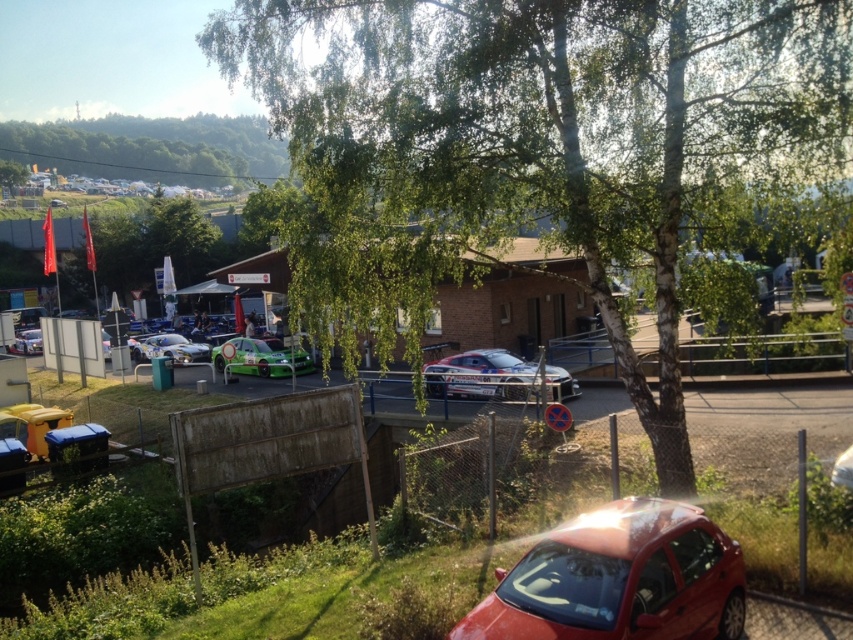
In order to click on green leafy tree at upper left in this screenshot , I will do `click(152, 147)`.

Between point (210, 150) and point (480, 396), which one is positioned behind?

The point (210, 150) is behind.

Locate an element on the screen. green leafy tree at upper left is located at coordinates (152, 147).

Based on the photo, which of these two, green leafy tree at upper left or green matte car at center, stands shorter?

With less height is green matte car at center.

Can you confirm if green leafy tree at upper left is smaller than green matte car at center?

Actually, green leafy tree at upper left might be larger than green matte car at center.

Between point (50, 138) and point (247, 353), which one is positioned behind?

Positioned behind is point (50, 138).

Identify the location of green leafy tree at upper left. This screenshot has height=640, width=853. (152, 147).

Who is shorter, green leafy tree at center or shiny metallic car at center-left?

With less height is shiny metallic car at center-left.

Is green leafy tree at center to the right of shiny metallic car at center-left from the viewer's perspective?

Yes, green leafy tree at center is to the right of shiny metallic car at center-left.

Between point (311, 102) and point (181, 346), which one is positioned behind?

Positioned behind is point (181, 346).

The width and height of the screenshot is (853, 640). I want to click on green leafy tree at center, so click(544, 148).